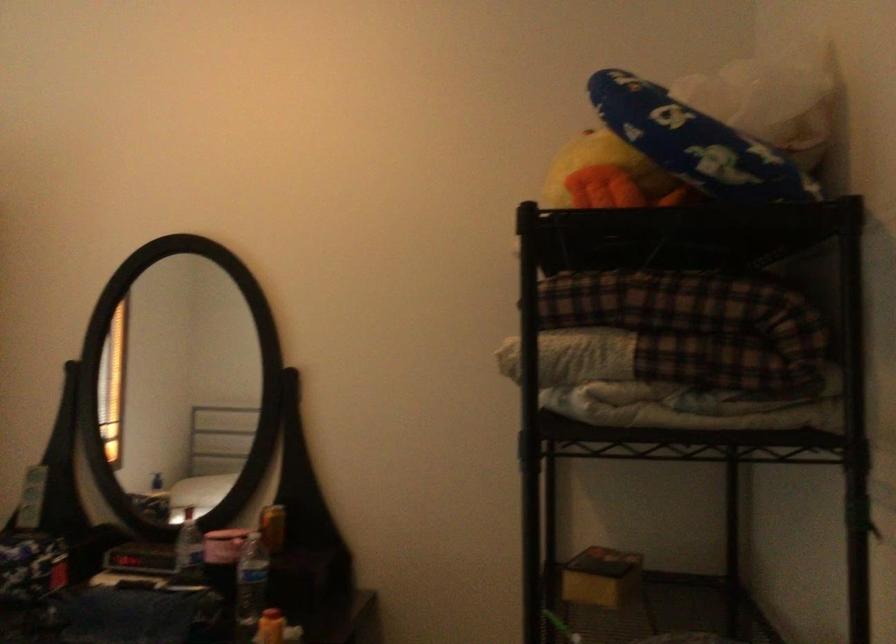
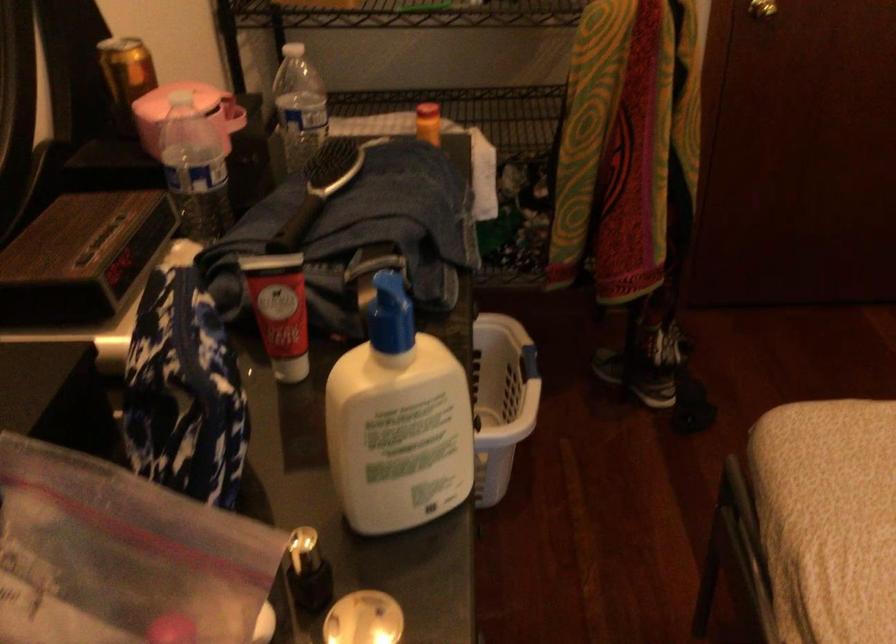
Locate, in the second image, the point that corresponds to [182,552] in the first image.

(194, 169)